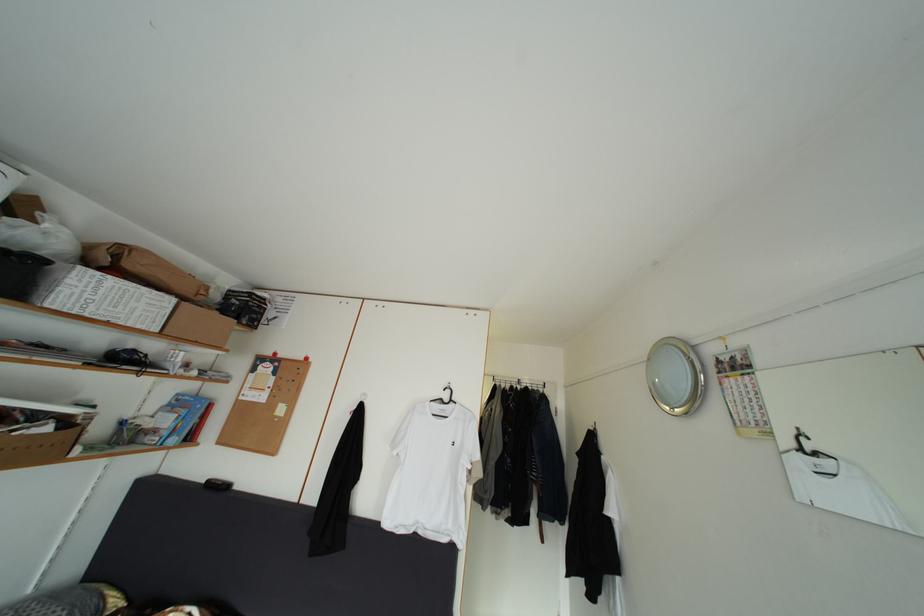
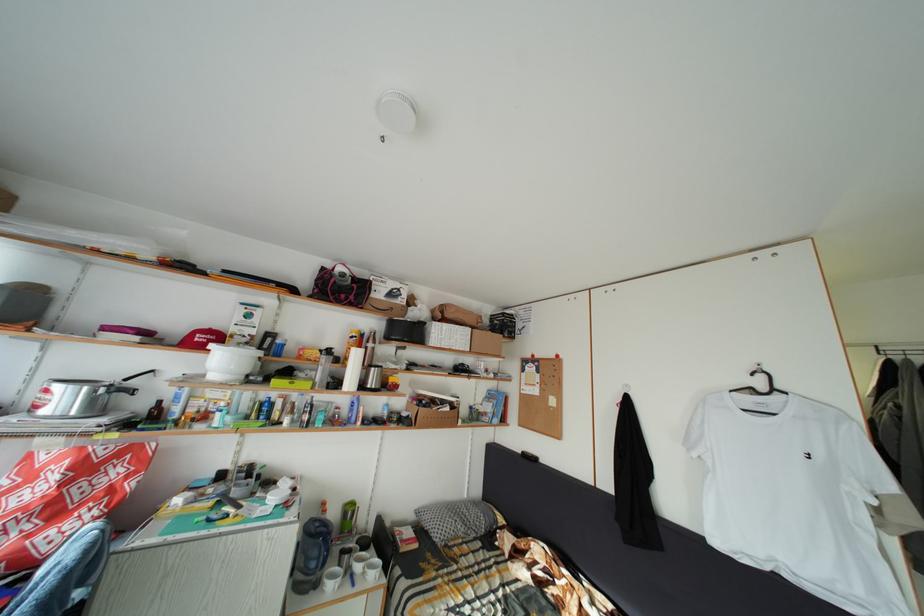
Question: The first image is from the beginning of the video and the second image is from the end. How did the camera likely rotate when shooting the video?

Choices:
 (A) Left
 (B) Right
 (C) Up
 (D) Down

Answer: (A)